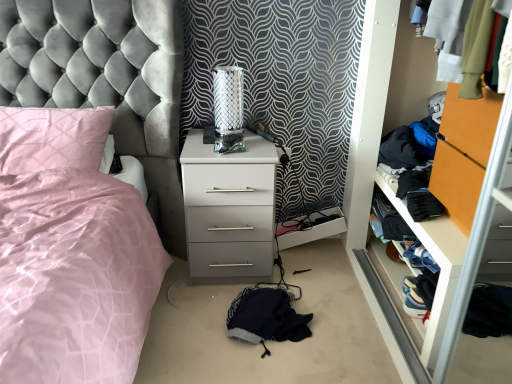
You are a GUI agent. You are given a task and a screenshot of the screen. Output one action in this format:
    pyautogui.click(x=<x>, y=<y>)
    Task: Click on the free spot to the left of denim fabric clothes at right
    
    Given the screenshot: What is the action you would take?
    pyautogui.click(x=339, y=304)